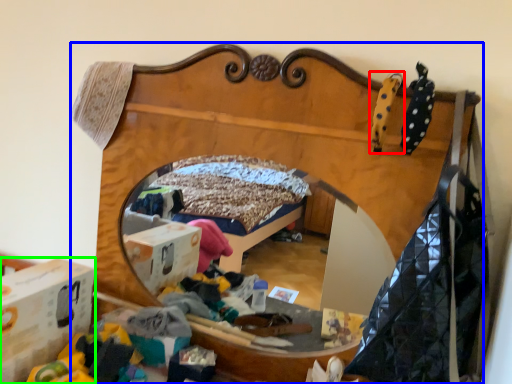
Question: Based on their relative distances, which object is nearer to toy (highlighted by a red box)? Choose from furniture (highlighted by a blue box) and cardboard box (highlighted by a green box).

Choices:
 (A) furniture
 (B) cardboard box

Answer: (A)